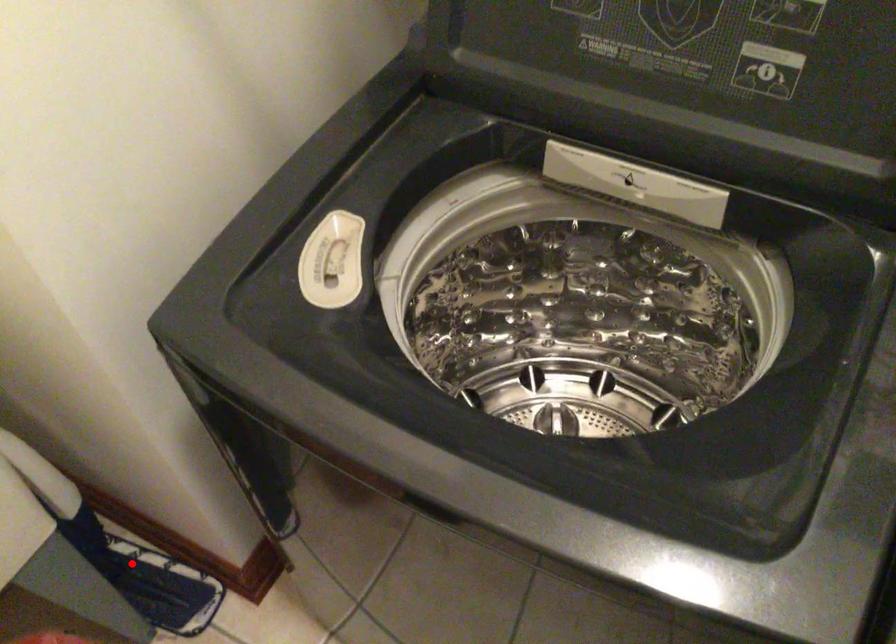
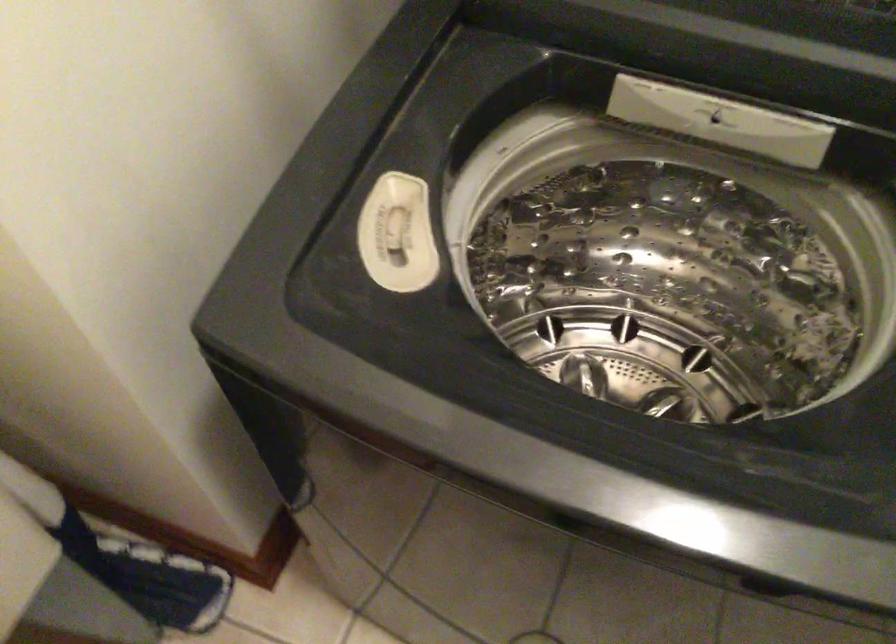
Where in the second image is the point corresponding to the highlighted location from the first image?

(125, 560)